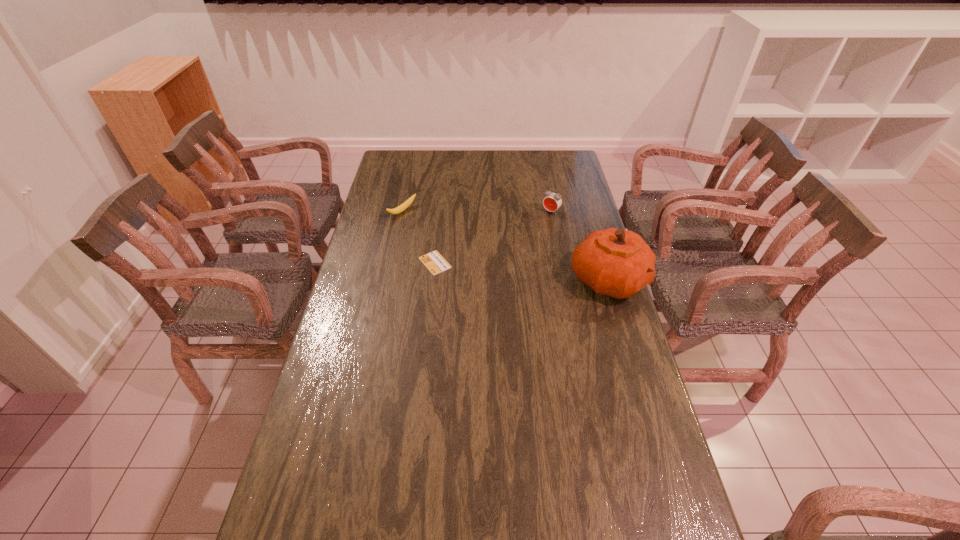
Identify the location of the shortest object. (435, 263).

What are the coordinates of `identity card` in the screenshot? It's located at (435, 263).

Where is `the tallest object`? the tallest object is located at coordinates (615, 262).

In order to click on the third shortest object in this screenshot , I will do `click(552, 201)`.

Where is `the leftmost object`? This screenshot has height=540, width=960. the leftmost object is located at coordinates (407, 203).

Locate an element on the screen. This screenshot has width=960, height=540. banana is located at coordinates (407, 203).

At what (x,y) coordinates should I click in order to perform the action: click on free space located 0.310m on the back of the third object from right to left. Please return your answer as a coordinate pair (x, y). Looking at the image, I should click on (442, 204).

Where is `free space located on the face of the third shortest object`? free space located on the face of the third shortest object is located at coordinates (529, 237).

I want to click on vacant area situated on the face of the third shortest object, so click(x=529, y=237).

Find the location of a particular element. Image resolution: width=960 pixels, height=540 pixels. free space located 0.170m on the face of the third shortest object is located at coordinates (528, 238).